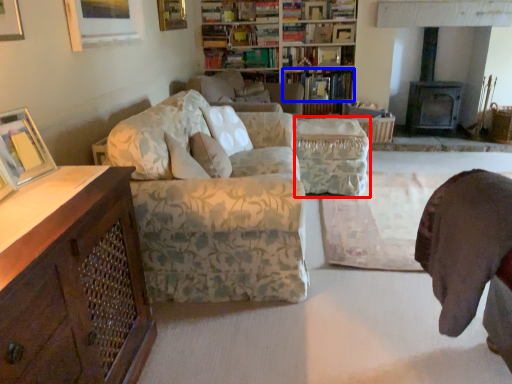
Question: Which object is closer to the camera taking this photo, footrest (highlighted by a red box) or book (highlighted by a blue box)?

Choices:
 (A) footrest
 (B) book

Answer: (A)